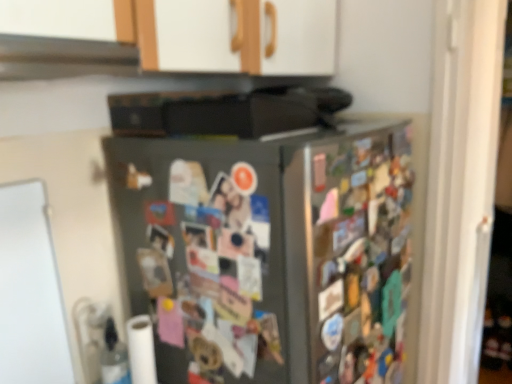
This screenshot has width=512, height=384. Describe the element at coordinates (141, 350) in the screenshot. I see `white matte toilet paper at lower left` at that location.

Locate an element on the screen. satin silver refrigerator at center is located at coordinates (269, 252).

Find the location of `white matte toilet paper at lower left`. white matte toilet paper at lower left is located at coordinates (141, 350).

Could you tell me if black matte exhaust hood at upper center is facing white matte toilet paper at lower left?

No, black matte exhaust hood at upper center is not aimed at white matte toilet paper at lower left.

From the image's perspective, is black matte exhaust hood at upper center located above or below white matte toilet paper at lower left?

Clearly, from the image's perspective, black matte exhaust hood at upper center is above white matte toilet paper at lower left.

Is there a large distance between black matte exhaust hood at upper center and white matte toilet paper at lower left?

No.

Which of these two, satin silver refrigerator at center or white matte toilet paper at lower left, is bigger?

satin silver refrigerator at center is bigger.

Is the depth of satin silver refrigerator at center less than that of white matte toilet paper at lower left?

Yes, it is in front of white matte toilet paper at lower left.

This screenshot has height=384, width=512. Identify the location of toilet paper that is behind the satin silver refrigerator at center. (141, 350).

From a real-world perspective, does satin silver refrigerator at center sit lower than white matte toilet paper at lower left?

Actually, satin silver refrigerator at center is physically above white matte toilet paper at lower left in the real world.

What's the angular difference between white matte toilet paper at lower left and satin silver refrigerator at center's facing directions?

There is a 0.384-degree angle between the facing directions of white matte toilet paper at lower left and satin silver refrigerator at center.

From a real-world perspective, which object rests below the other?

From a 3D spatial view, white matte toilet paper at lower left is below.

Which object is more forward, white matte toilet paper at lower left or satin silver refrigerator at center?

satin silver refrigerator at center is closer to the camera.

Is point (154, 381) positioned behind point (394, 280)?

No, (154, 381) is closer to viewer.

Is white matte toilet paper at lower left placed right next to black matte exhaust hood at upper center?

No, white matte toilet paper at lower left is not beside black matte exhaust hood at upper center.

Between white matte toilet paper at lower left and black matte exhaust hood at upper center, which one is positioned in front?

black matte exhaust hood at upper center is closer to the camera.

From the image's perspective, who appears lower, white matte toilet paper at lower left or black matte exhaust hood at upper center?

white matte toilet paper at lower left is shown below in the image.

Can you confirm if white matte toilet paper at lower left is smaller than black matte exhaust hood at upper center?

Indeed, white matte toilet paper at lower left has a smaller size compared to black matte exhaust hood at upper center.

Which is in front, satin silver refrigerator at center or black matte exhaust hood at upper center?

Positioned in front is black matte exhaust hood at upper center.

Is satin silver refrigerator at center surrounding black matte exhaust hood at upper center?

No, satin silver refrigerator at center does not contain black matte exhaust hood at upper center.

How distant is satin silver refrigerator at center from black matte exhaust hood at upper center?

satin silver refrigerator at center and black matte exhaust hood at upper center are 17.11 inches apart from each other.

Can you tell me how much satin silver refrigerator at center and black matte exhaust hood at upper center differ in facing direction?

satin silver refrigerator at center and black matte exhaust hood at upper center are facing 0.175 degrees away from each other.

Looking at this image, from a real-world perspective, is black matte exhaust hood at upper center physically below satin silver refrigerator at center?

No, from a real-world perspective, black matte exhaust hood at upper center is not below satin silver refrigerator at center.

Considering the relative sizes of black matte exhaust hood at upper center and satin silver refrigerator at center in the image provided, is black matte exhaust hood at upper center bigger than satin silver refrigerator at center?

Actually, black matte exhaust hood at upper center might be smaller than satin silver refrigerator at center.

Who is taller, black matte exhaust hood at upper center or satin silver refrigerator at center?

satin silver refrigerator at center is taller.

The width and height of the screenshot is (512, 384). Find the location of `exhaust hood above the white matte toilet paper at lower left (from a real-world perspective)`. exhaust hood above the white matte toilet paper at lower left (from a real-world perspective) is located at coordinates (63, 57).

I want to click on toilet paper on the left of satin silver refrigerator at center, so click(x=141, y=350).

Which object lies further to the anchor point black matte exhaust hood at upper center, satin silver refrigerator at center or white matte toilet paper at lower left?

white matte toilet paper at lower left is further to black matte exhaust hood at upper center.

From the picture: Which object lies nearer to the anchor point white matte toilet paper at lower left, black matte exhaust hood at upper center or satin silver refrigerator at center?

satin silver refrigerator at center is closer to white matte toilet paper at lower left.

Based on their spatial positions, is black matte exhaust hood at upper center or white matte toilet paper at lower left further from satin silver refrigerator at center?

black matte exhaust hood at upper center.

Considering their positions, is white matte toilet paper at lower left positioned further to satin silver refrigerator at center than black matte exhaust hood at upper center?

Among the two, black matte exhaust hood at upper center is located further to satin silver refrigerator at center.

Considering their positions, is white matte toilet paper at lower left positioned closer to black matte exhaust hood at upper center than satin silver refrigerator at center?

Based on the image, satin silver refrigerator at center appears to be nearer to black matte exhaust hood at upper center.

When comparing their distances from white matte toilet paper at lower left, does satin silver refrigerator at center or black matte exhaust hood at upper center seem further?

The object further to white matte toilet paper at lower left is black matte exhaust hood at upper center.

Identify the location of refrigerator between black matte exhaust hood at upper center and white matte toilet paper at lower left from top to bottom. Image resolution: width=512 pixels, height=384 pixels. 269,252.